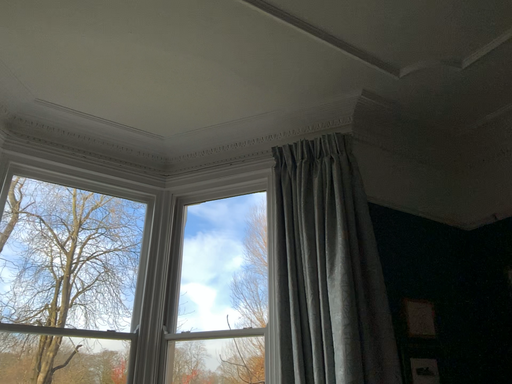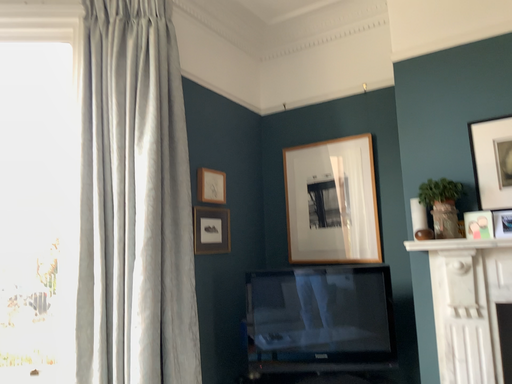
Question: How did the camera likely rotate when shooting the video?

Choices:
 (A) rotated right
 (B) rotated left

Answer: (A)